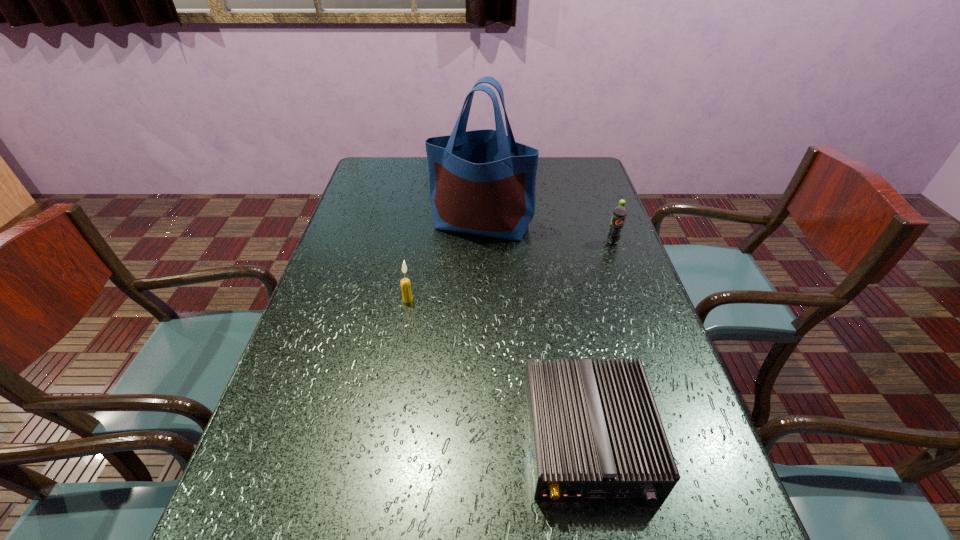
Identify the location of free space that is in between the rightmost object and the third farthest object. (510, 271).

Identify the location of empty location between the nearest object and the handbag. The width and height of the screenshot is (960, 540). (535, 331).

Find the location of `free space between the shortest object and the soda`. free space between the shortest object and the soda is located at coordinates (600, 340).

Locate an element on the screen. The image size is (960, 540). free space between the leftmost object and the rightmost object is located at coordinates (510, 271).

Find the location of a particular element. The image size is (960, 540). vacant area that lies between the second nearest object and the soda is located at coordinates (510, 271).

Where is `free space between the second nearest object and the tallest object`? free space between the second nearest object and the tallest object is located at coordinates (444, 262).

Identify the location of object that ranks as the third closest to the candle. (619, 213).

The width and height of the screenshot is (960, 540). I want to click on object that is the third closest to the tallest object, so click(595, 432).